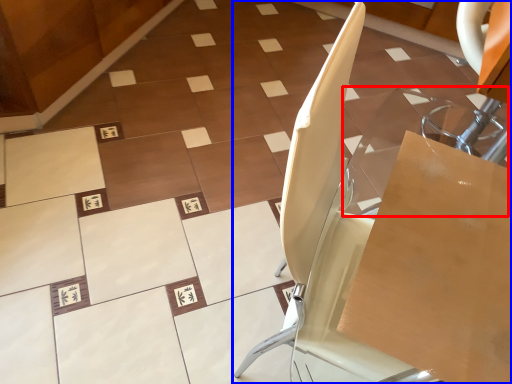
Question: Which object is further to the camera taking this photo, glass table (highlighted by a red box) or furniture (highlighted by a blue box)?

Choices:
 (A) glass table
 (B) furniture

Answer: (A)